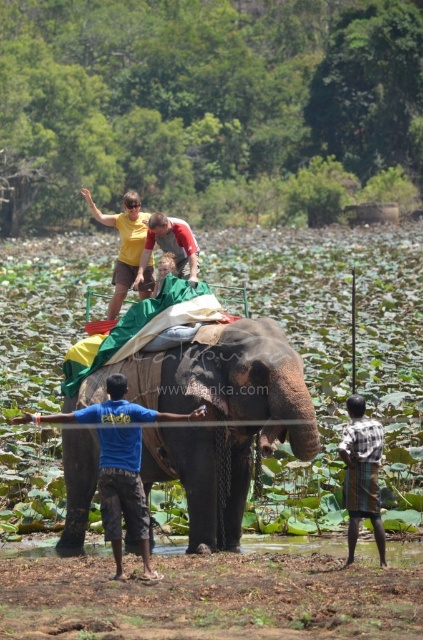
Based on the photo, who is more distant from viewer, (134, 192) or (142, 276)?

Positioned behind is point (134, 192).

Between point (93, 212) and point (189, 256), which one is positioned in front?

Positioned in front is point (189, 256).

What are the coordinates of `yellow fabric at center` in the screenshot? It's located at (123, 243).

Which is more to the right, plaid shirt at lower right or reddish-brown leather jacket at upper center?

Positioned to the right is plaid shirt at lower right.

Does point (370, 461) come in front of point (164, 218)?

Yes, point (370, 461) is in front of point (164, 218).

Find the location of a particular element. This screenshot has width=423, height=640. plaid shirt at lower right is located at coordinates (362, 474).

Does brown textured elephant at center have a lesser height compared to reddish-brown leather jacket at upper center?

Incorrect, brown textured elephant at center's height does not fall short of reddish-brown leather jacket at upper center's.

Does point (198, 380) come behind point (164, 224)?

No, (198, 380) is in front of (164, 224).

The height and width of the screenshot is (640, 423). Find the location of `brown textured elephant at center`. brown textured elephant at center is located at coordinates (222, 381).